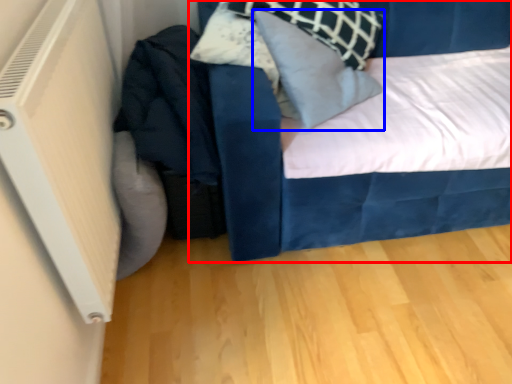
Question: Which of the following is the farthest to the observer, bed (highlighted by a red box) or pillow (highlighted by a blue box)?

Choices:
 (A) bed
 (B) pillow

Answer: (B)